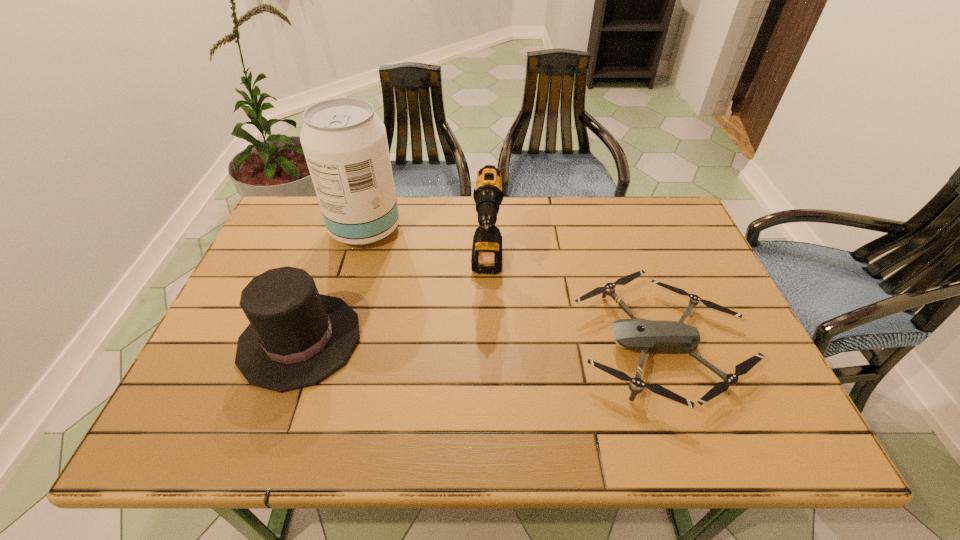
Locate an element on the screen. The image size is (960, 540). blank space located with a camera mounted on the front of the shortest object is located at coordinates (514, 345).

Locate an element on the screen. vacant space situated 0.250m with a camera mounted on the front of the shortest object is located at coordinates (471, 345).

Find the location of a particular element. Image resolution: width=960 pixels, height=540 pixels. alcohol that is at the far edge is located at coordinates (345, 144).

The width and height of the screenshot is (960, 540). Find the location of `drill located at the far edge`. drill located at the far edge is located at coordinates (486, 257).

The height and width of the screenshot is (540, 960). Find the location of `object that is at the near edge`. object that is at the near edge is located at coordinates (653, 336).

You are a GUI agent. You are given a task and a screenshot of the screen. Output one action in this format:
    pyautogui.click(x=<x>, y=<y>)
    Task: Click on the object at the left edge
    This screenshot has width=960, height=540.
    Given the screenshot: What is the action you would take?
    pyautogui.click(x=297, y=337)

Where is `object present at the right edge`? The width and height of the screenshot is (960, 540). object present at the right edge is located at coordinates (653, 336).

Where is `object at the near right corner`? object at the near right corner is located at coordinates (653, 336).

The height and width of the screenshot is (540, 960). Find the location of `blank space at the far edge of the desktop`. blank space at the far edge of the desktop is located at coordinates (547, 207).

In the image, there is a desktop. Where is `vacant space at the near edge`? This screenshot has height=540, width=960. vacant space at the near edge is located at coordinates (478, 420).